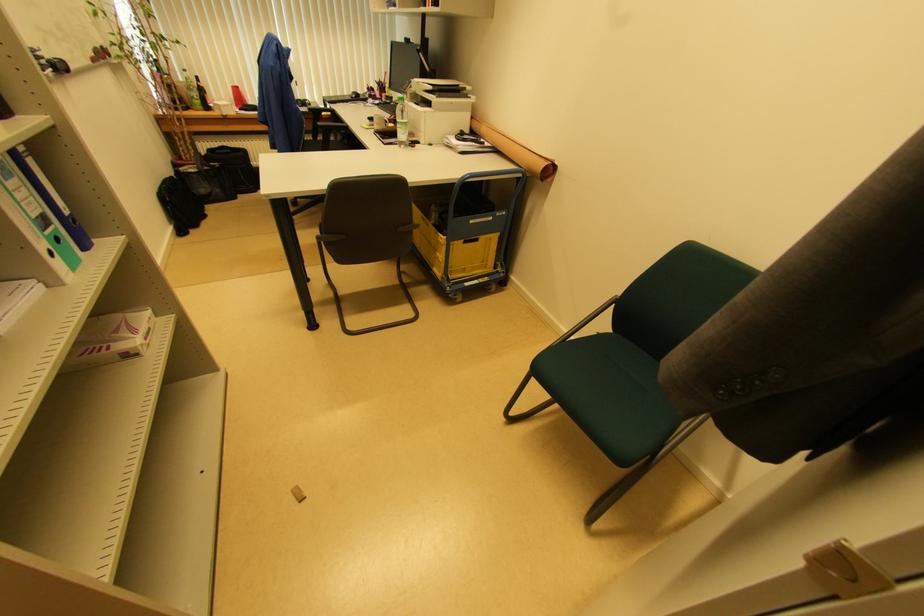
This screenshot has width=924, height=616. What do you see at coordinates (615, 397) in the screenshot? I see `the green chair sitting surface` at bounding box center [615, 397].